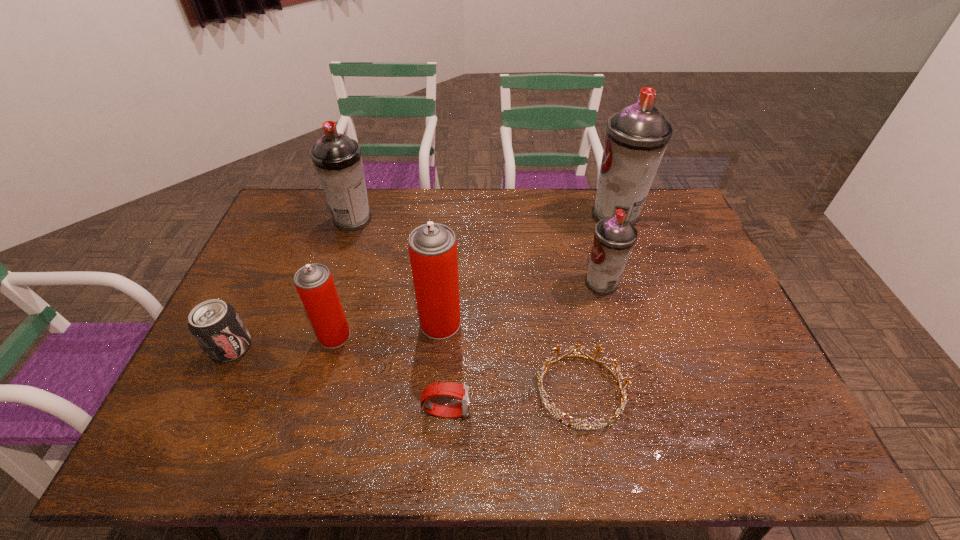
Locate an element on the screen. The image size is (960, 540). vacant space at the left edge of the desktop is located at coordinates (235, 307).

The width and height of the screenshot is (960, 540). I want to click on vacant space at the right edge of the desktop, so click(669, 251).

I want to click on vacant space at the far left corner of the desktop, so click(x=287, y=212).

Identify the location of free location at the near left corner. (186, 424).

I want to click on empty space that is in between the biggest gray aerosol can and the leftmost gray aerosol can, so click(x=485, y=217).

Where is `free space between the shortest object and the tallest aerosol can`? The image size is (960, 540). free space between the shortest object and the tallest aerosol can is located at coordinates (598, 303).

Locate an element on the screen. Image resolution: width=960 pixels, height=540 pixels. free spot between the right red aerosol can and the seventh tallest object is located at coordinates (444, 367).

Find the location of a particular element. This screenshot has height=540, width=960. vacant point located between the tiara and the soda can is located at coordinates (406, 369).

Where is `free area in between the smaller red aerosol can and the tiara`? The image size is (960, 540). free area in between the smaller red aerosol can and the tiara is located at coordinates (457, 363).

This screenshot has height=540, width=960. In order to click on free space that is in between the tallest aerosol can and the right red aerosol can in this screenshot , I will do `click(528, 269)`.